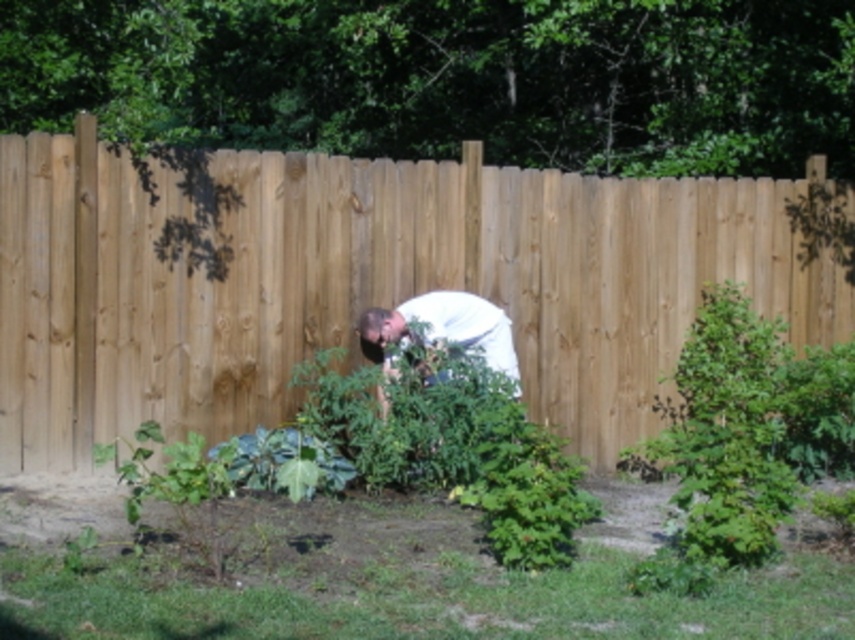
You are standing in the backyard garden and notice the natural wood fence at center and the white matte shirt at center. Which object is taller when viewed from your current position?

The natural wood fence at center is taller than the white matte shirt at center.

You are a gardener wearing a white matte shirt at center and want to reach the plants behind the natural wood fence at center. Can you comfortably lean over the fence to tend to them without your shirt getting dirty?

The natural wood fence at center is only 21.33 inches away from the white matte shirt at center. Since the distance is very short, you can easily lean over the fence to tend to the plants without your shirt getting dirty.

You are standing at the edge of the garden and want to place a 2.5 meter long wooden bench between the natural wood fence at center and the dense green foliage in the background. Is there enough space for the bench to fit without overlapping either the fence or the foliage?

The natural wood fence at center and the dense green foliage in the background are 8.22 meters apart. Since the bench is only 2.5 meters long, there is more than enough space to place it between them without overlapping either the fence or the foliage.